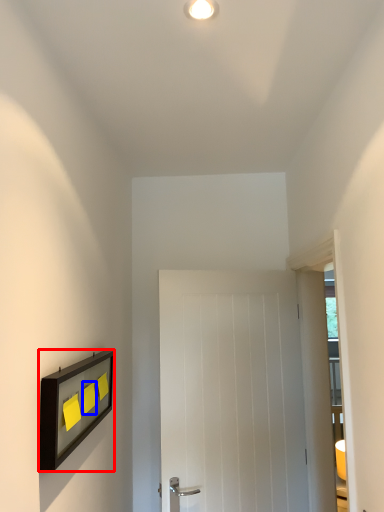
Question: Which object is further to the camera taking this photo, picture frame (highlighted by a red box) or light switch (highlighted by a blue box)?

Choices:
 (A) picture frame
 (B) light switch

Answer: (B)